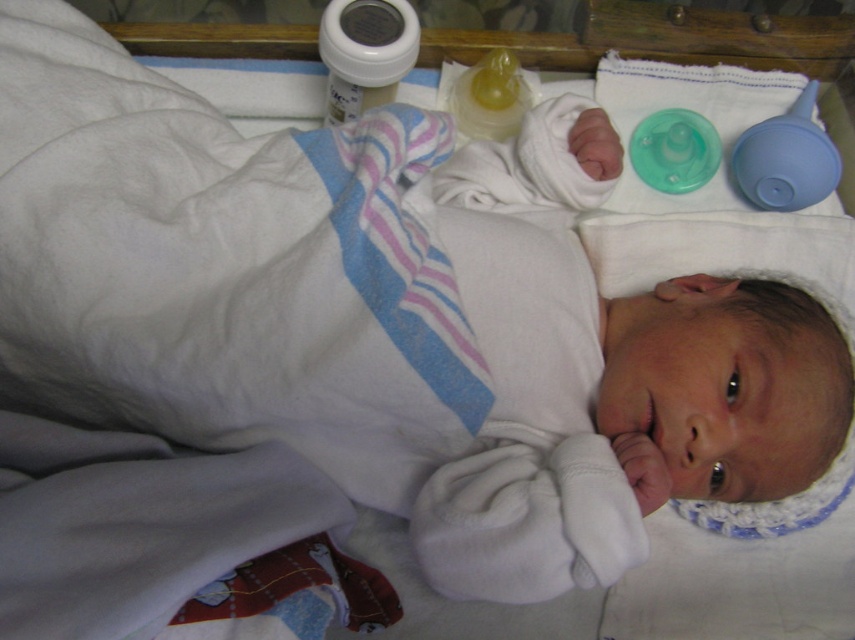
Question: Does white plastic bottle at upper center appear under rubber teething ring at center?

Choices:
 (A) yes
 (B) no

Answer: (B)

Question: Considering the real-world distances, which object is farthest from the blue rubber pacifier at upper right?

Choices:
 (A) green rubber teether at upper right
 (B) rubber teething ring at center

Answer: (B)

Question: Which of the following is the closest to the observer?

Choices:
 (A) translucent yellow baby bottle at upper center
 (B) white plastic bottle at upper center

Answer: (B)

Question: Does blue rubber pacifier at upper right appear under translucent yellow baby bottle at upper center?

Choices:
 (A) yes
 (B) no

Answer: (A)

Question: Which of these objects is positioned closest to the translucent yellow baby bottle at upper center?

Choices:
 (A) white plastic bottle at upper center
 (B) green rubber teether at upper right
 (C) rubber teething ring at center
 (D) blue rubber pacifier at upper right

Answer: (A)

Question: Can you confirm if blue rubber pacifier at upper right is bigger than translucent yellow baby bottle at upper center?

Choices:
 (A) yes
 (B) no

Answer: (A)